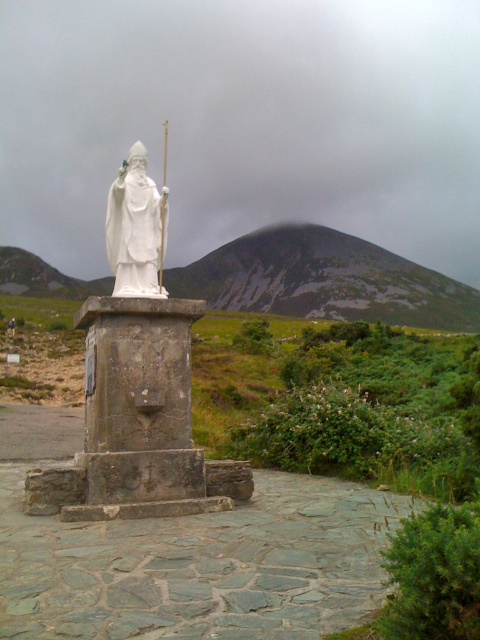
Who is higher up, white porcelain statue at center or white stone statue at center?

white porcelain statue at center is above.

Locate an element on the screen. The height and width of the screenshot is (640, 480). white porcelain statue at center is located at coordinates (135, 227).

Does point (111, 241) come in front of point (9, 324)?

Yes, it is in front of point (9, 324).

Locate an element on the screen. The width and height of the screenshot is (480, 640). white porcelain statue at center is located at coordinates (135, 227).